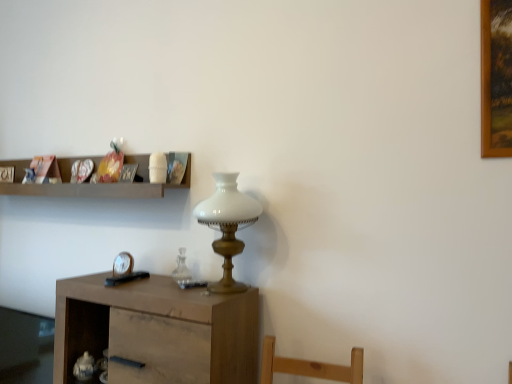
This screenshot has width=512, height=384. Find the location of `vacant space situated above wooden cabinet at center (from a real-world perspective)`. vacant space situated above wooden cabinet at center (from a real-world perspective) is located at coordinates (158, 290).